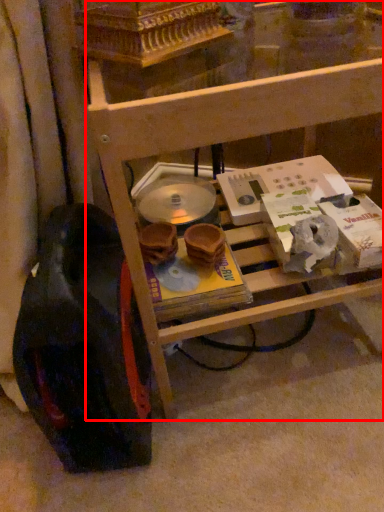
Question: From the image's perspective, what is the correct spatial positioning of furniture (annotated by the red box) in reference to wheel?

Choices:
 (A) above
 (B) below

Answer: (A)